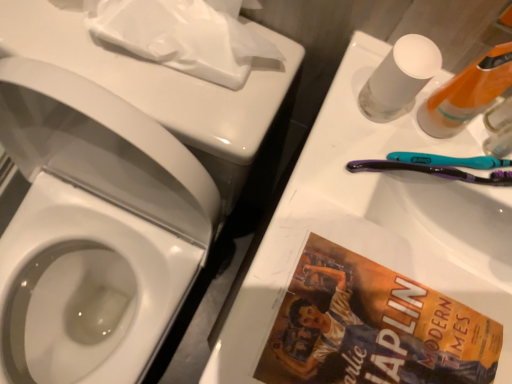
Where is `vacant area on top of white glossy sink at upper right (from a real-world perspective)`? vacant area on top of white glossy sink at upper right (from a real-world perspective) is located at coordinates (390, 249).